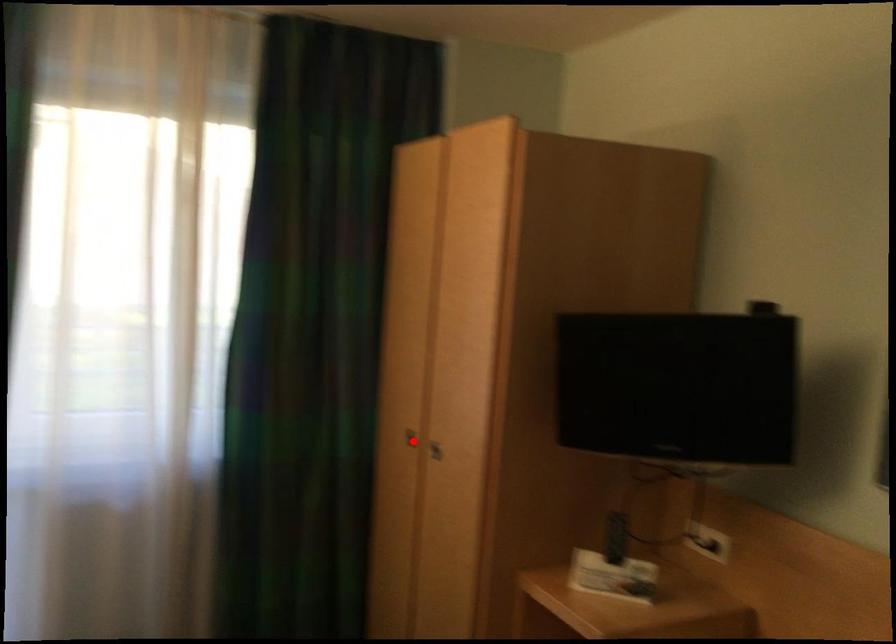
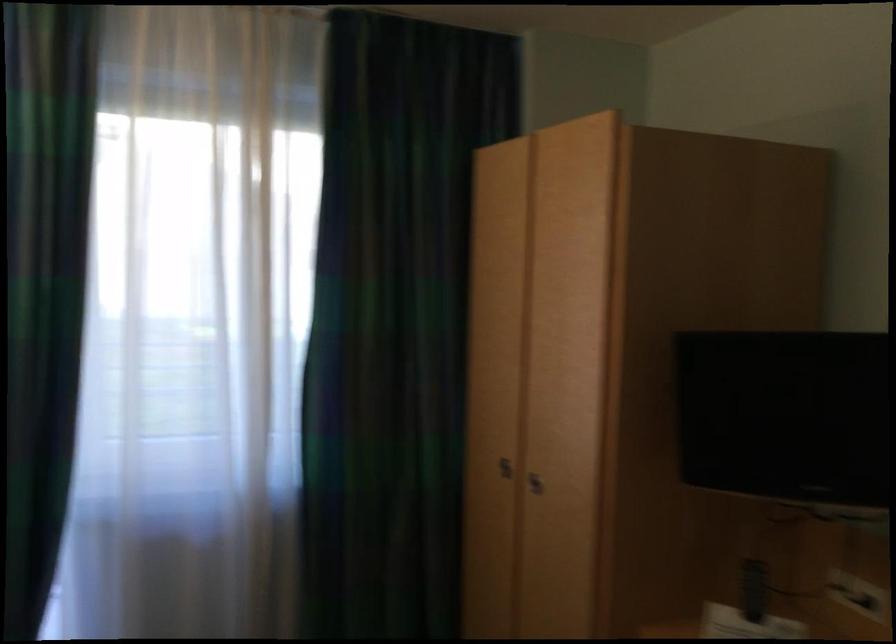
The point at the highlighted location is marked in the first image. Where is the corresponding point in the second image?

(504, 468)